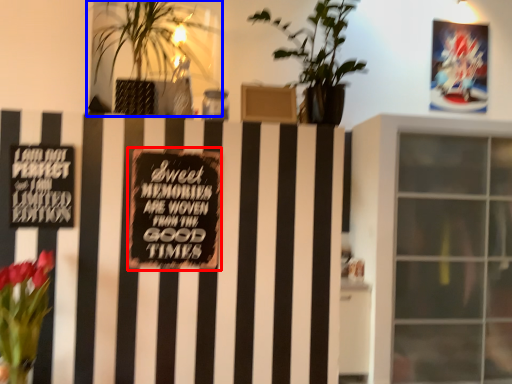
Question: Which of the following is the farthest to the observer, plaque (highlighted by a red box) or houseplant (highlighted by a blue box)?

Choices:
 (A) plaque
 (B) houseplant

Answer: (A)